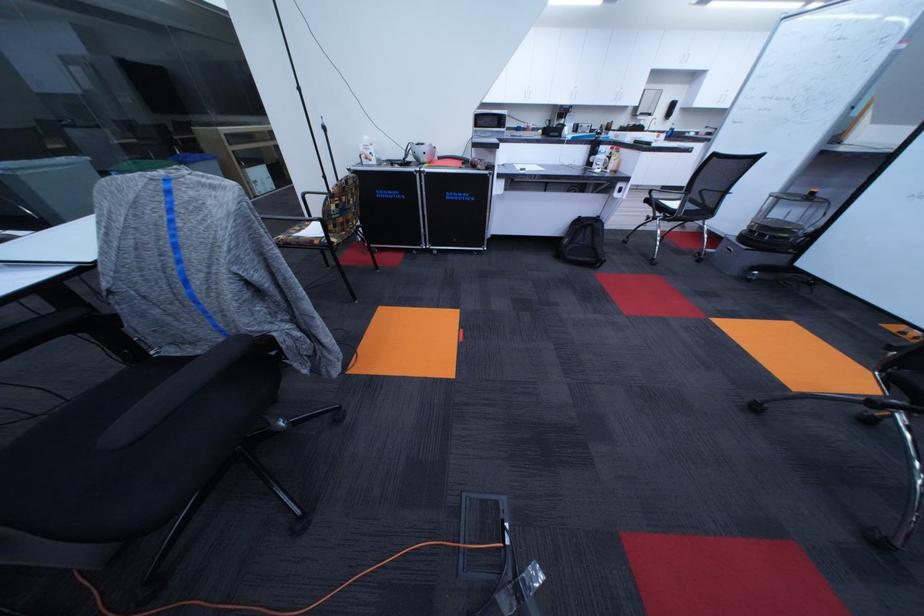
This screenshot has height=616, width=924. Identify the location of pump dispenser head. (613, 163).